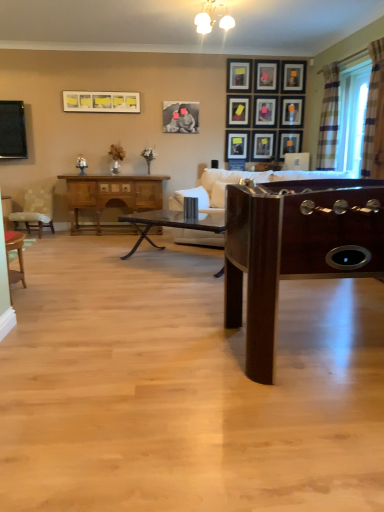
Question: In which direction should I rotate to look at matte black picture frame at upper center, which appears as the fourth picture frame when viewed from the right?

Choices:
 (A) right
 (B) left

Answer: (A)

Question: Does matte black picture frame at upper right, the eighth picture frame positioned from the left, have a greater height compared to plaid fabric curtain at right, the second curtain from the back?

Choices:
 (A) no
 (B) yes

Answer: (A)

Question: Is matte black picture frame at upper right, the third picture frame in the right-to-left sequence, beside plaid fabric curtain at right, the first curtain from the front?

Choices:
 (A) yes
 (B) no

Answer: (B)

Question: From the image's perspective, is matte black picture frame at upper right, the third picture frame in the right-to-left sequence, on plaid fabric curtain at right, the first curtain from the front?

Choices:
 (A) yes
 (B) no

Answer: (A)

Question: From the image's perspective, is matte black picture frame at upper right, the third picture frame in the right-to-left sequence, beneath plaid fabric curtain at right, the first curtain from the front?

Choices:
 (A) yes
 (B) no

Answer: (B)

Question: Is matte black picture frame at upper right, the third picture frame in the right-to-left sequence, completely or partially outside of plaid fabric curtain at right, the first curtain from the front?

Choices:
 (A) yes
 (B) no

Answer: (A)

Question: Is the position of matte black picture frame at upper right, the third picture frame in the right-to-left sequence, more distant than that of plaid fabric curtain at right, the first curtain from the front?

Choices:
 (A) no
 (B) yes

Answer: (B)

Question: Does matte black picture frame at upper center, which appears as the second picture frame when viewed from the right, lie in front of wooden chair at lower left, marked as the 2th chair in a top-to-bottom arrangement?

Choices:
 (A) no
 (B) yes

Answer: (A)

Question: Would you say matte black picture frame at upper center, the 9th picture frame viewed from the left, contains wooden chair at lower left, which appears as the first chair when ordered from the bottom?

Choices:
 (A) yes
 (B) no

Answer: (B)

Question: Considering the relative sizes of matte black picture frame at upper center, which appears as the second picture frame when viewed from the right, and wooden chair at lower left, marked as the 2th chair in a top-to-bottom arrangement, in the image provided, is matte black picture frame at upper center, which appears as the second picture frame when viewed from the right, taller than wooden chair at lower left, marked as the 2th chair in a top-to-bottom arrangement,?

Choices:
 (A) no
 (B) yes

Answer: (A)

Question: Is matte black picture frame at upper center, which appears as the second picture frame when viewed from the right, thinner than wooden chair at lower left, arranged as the 1th chair when viewed from the right?

Choices:
 (A) no
 (B) yes

Answer: (B)

Question: From the image's perspective, is matte black picture frame at upper center, the 9th picture frame viewed from the left, above wooden chair at lower left, arranged as the 1th chair when viewed from the right?

Choices:
 (A) yes
 (B) no

Answer: (A)

Question: Is matte black picture frame at upper center, the 9th picture frame viewed from the left, not within wooden chair at lower left, which is counted as the 2th chair, starting from the back?

Choices:
 (A) yes
 (B) no

Answer: (A)

Question: Is matte black television at left positioned behind clear plastic window screen at right?

Choices:
 (A) yes
 (B) no

Answer: (A)